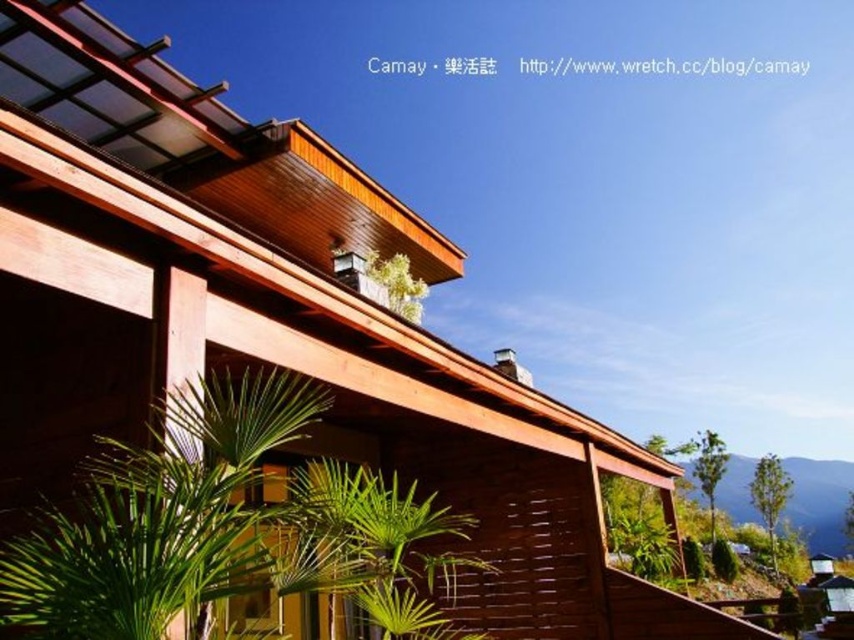
Looking at this image, you are a gardener who needs to water both the green matte plant at upper center and the green leafy plant at lower right. Given that your watering can holds enough water for 30 meters of travel, can you water both plants without refilling?

The distance between the green matte plant at upper center and the green leafy plant at lower right is 28.51 meters. Since the watering can holds enough for 30 meters, you can water both plants without needing to refill.

You are a gardener standing on the porch of the modern wooden house. You see the green matte plant at upper center and the green leafy plant at lower right. Which plant is positioned to the left when viewed from your perspective?

The green matte plant at upper center is positioned to the left of the green leafy plant at lower right.